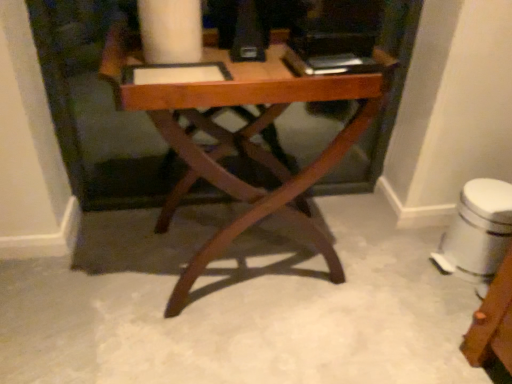
This screenshot has height=384, width=512. In order to click on vacant area situated to the left side of wooden table at center in this screenshot , I will do `click(86, 273)`.